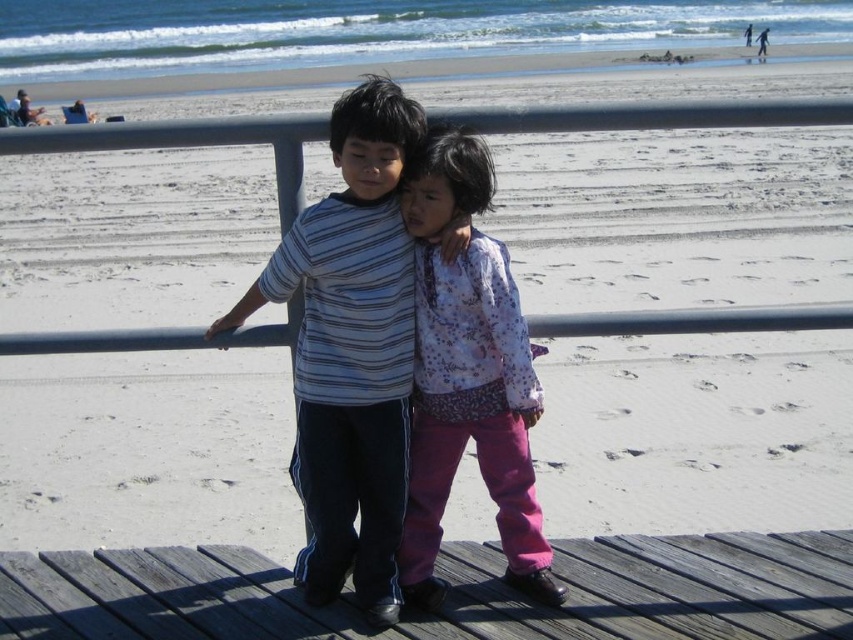
You are a photographer trying to capture a photo of both the striped cotton shirt at center and the floral fabric shirt at center. Since you want both shirts to be clearly visible in the photo, which shirt should you focus on first to ensure proper focus, considering their sizes?

The striped cotton shirt at center is much taller than the floral fabric shirt at center, so you should focus on the striped cotton shirt at center first to ensure proper focus since it is larger and more prominent in the frame.